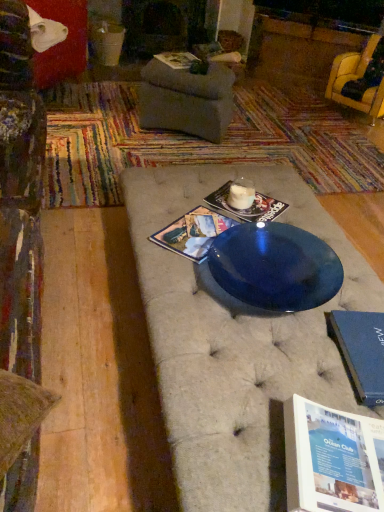
Question: From a real-world perspective, relative to matte paper magazine at center, arranged as the third magazine when viewed from the back, is matte paper magazine at center, the second magazine viewed from the back, vertically above or below?

Choices:
 (A) below
 (B) above

Answer: (A)

Question: From the image's perspective, is matte paper magazine at center, the second magazine positioned from the top, above or below matte paper magazine at center, acting as the first magazine starting from the bottom?

Choices:
 (A) above
 (B) below

Answer: (A)

Question: Based on their relative distances, which object is nearer to the blue hardcover book at lower right?

Choices:
 (A) matte paper magazine at center, the second magazine viewed from the back
 (B) matte gray ottoman at center
 (C) shiny blue glass plate at center
 (D) matte paper magazine at upper center, which is the first magazine from top to bottom
 (E) matte paper magazine at center, the third magazine when ordered from top to bottom

Answer: (C)

Question: Which of these objects is positioned farthest from the shiny blue glass plate at center?

Choices:
 (A) yellow fabric chair at upper right
 (B) matte paper magazine at center, acting as the first magazine starting from the bottom
 (C) matte gray ottoman at center
 (D) blue hardcover book at lower right
 (E) matte paper magazine at center, arranged as the 2th magazine when viewed from the front

Answer: (A)